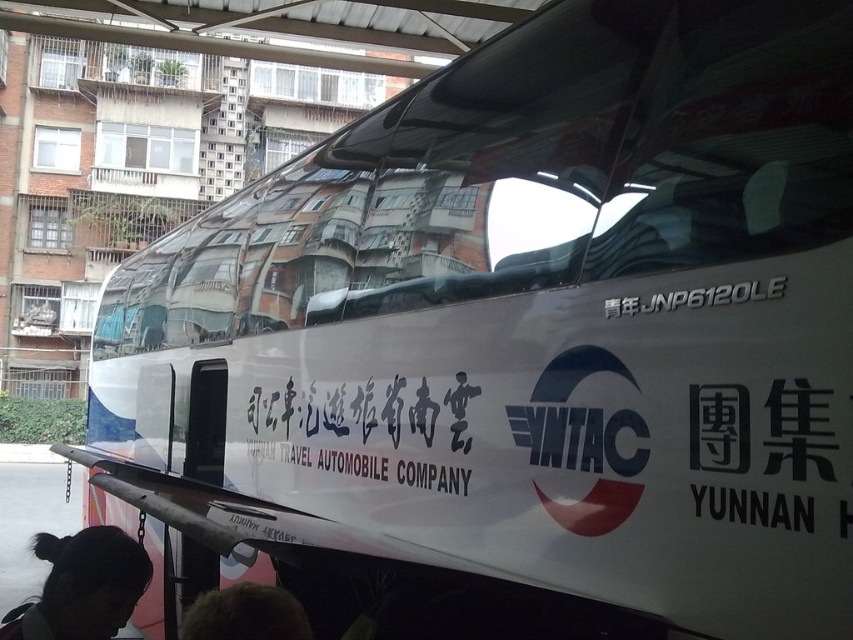
Is black hair at lower left smaller than dark brown hair at lower center?

Actually, black hair at lower left might be larger than dark brown hair at lower center.

Does black hair at lower left lie in front of dark brown hair at lower center?

No, it is behind dark brown hair at lower center.

Does point (57, 616) come in front of point (263, 593)?

No, it is behind (263, 593).

You are a GUI agent. You are given a task and a screenshot of the screen. Output one action in this format:
    pyautogui.click(x=<x>, y=<y>)
    Task: Click on the black hair at lower left
    Image resolution: width=853 pixels, height=640 pixels.
    Given the screenshot: What is the action you would take?
    pyautogui.click(x=82, y=586)

Between dark brown hair at lower center and white metallic text at center, which one appears on the left side from the viewer's perspective?

Positioned to the left is dark brown hair at lower center.

Where is `dark brown hair at lower center`? dark brown hair at lower center is located at coordinates (245, 614).

Between point (283, 636) and point (646, 308), which one is positioned behind?

Positioned behind is point (646, 308).

This screenshot has width=853, height=640. Identify the location of dark brown hair at lower center. (245, 614).

Does black hair at lower left appear on the right side of white metallic text at center?

In fact, black hair at lower left is to the left of white metallic text at center.

Is point (134, 541) less distant than point (682, 305)?

No, it is behind (682, 305).

The height and width of the screenshot is (640, 853). Identify the location of black hair at lower left. (82, 586).